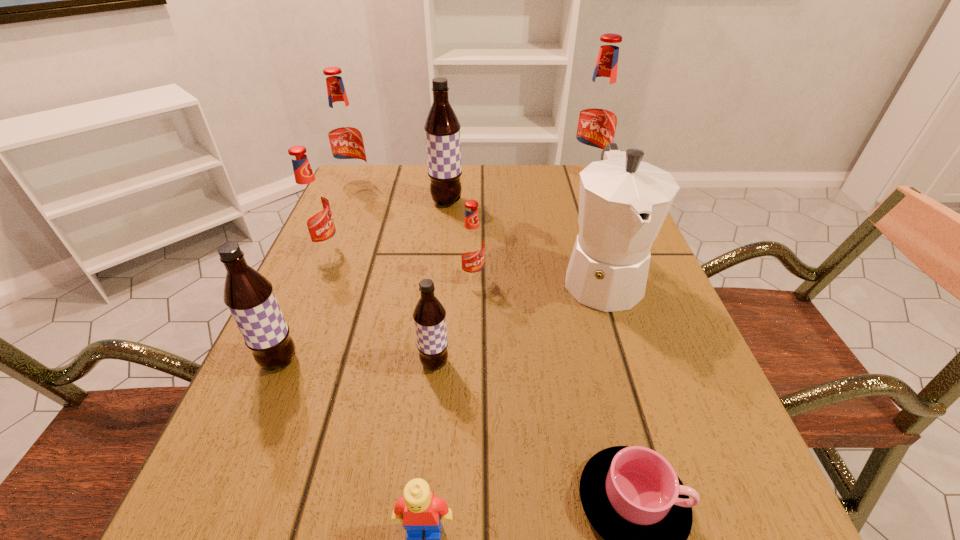
The width and height of the screenshot is (960, 540). In order to click on the smallest red root beer in this screenshot , I will do `click(471, 245)`.

You are a GUI agent. You are given a task and a screenshot of the screen. Output one action in this format:
    pyautogui.click(x=<x>, y=<y>)
    Task: Click on the vacant space positioned on the left of the biggest red root beer
    This screenshot has height=540, width=960.
    Given the screenshot: What is the action you would take?
    pyautogui.click(x=547, y=179)

I want to click on vacant space situated on the right of the second biggest red root beer, so pos(404,186).

Locate an element on the screen. free point located on the front of the farthest brown root beer is located at coordinates (435, 308).

I want to click on blank space located 0.190m at the spout of the coffeepot, so click(646, 418).

What are the coordinates of `vacant space positioned 0.260m on the right of the second nearest red root beer` in the screenshot? It's located at (458, 251).

Locate an element on the screen. This screenshot has width=960, height=540. free space located 0.340m on the right of the second biggest brown root beer is located at coordinates click(x=501, y=361).

This screenshot has height=540, width=960. Identify the location of free space located on the back of the smallest brown root beer. pos(442,292).

Locate an element on the screen. Image resolution: width=960 pixels, height=540 pixels. free spot located on the front of the third red root beer from left to right is located at coordinates (470, 372).

Locate an element on the screen. root beer that is at the right edge is located at coordinates (597, 119).